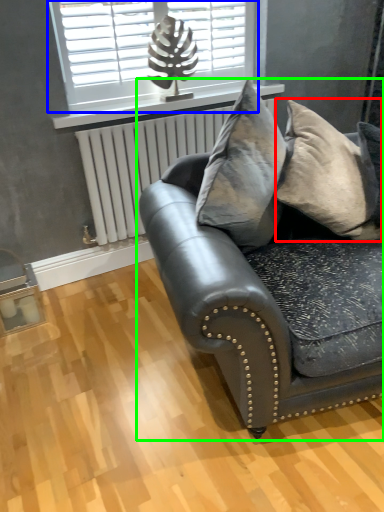
Question: Based on their relative distances, which object is farther from pillow (highlighted by a red box)? Choose from window (highlighted by a blue box) and studio couch (highlighted by a green box).

Choices:
 (A) window
 (B) studio couch

Answer: (A)